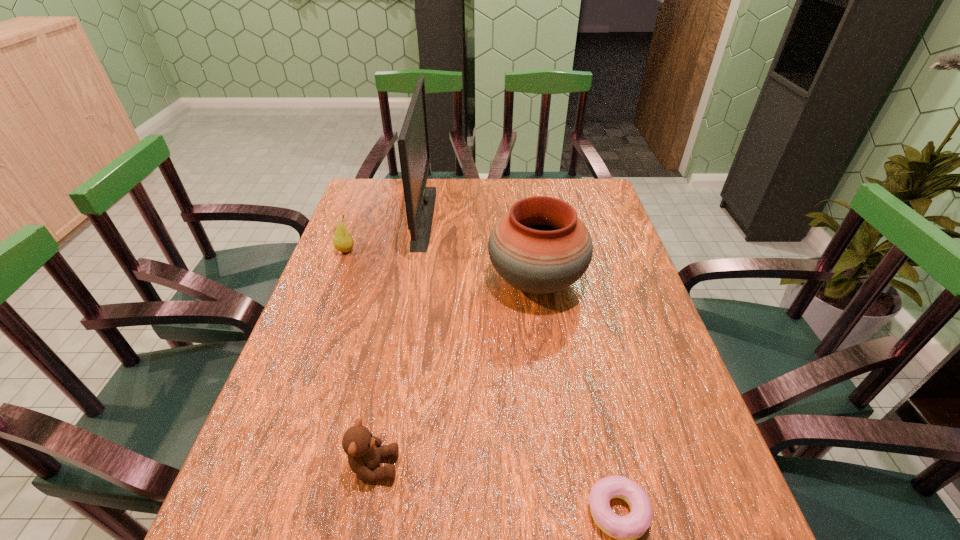
Locate an element on the screen. This screenshot has height=540, width=960. object situated at the right edge is located at coordinates (540, 246).

In the image, there is a desktop. Where is `free space at the far edge`? free space at the far edge is located at coordinates (441, 180).

Locate an element on the screen. vacant space at the left edge is located at coordinates (348, 287).

At what (x,y) coordinates should I click in order to perform the action: click on free space at the right edge of the desktop. Please return your answer as a coordinate pair (x, y). Looking at the image, I should click on (597, 241).

I want to click on free space at the far right corner, so click(588, 195).

The width and height of the screenshot is (960, 540). I want to click on free space between the teddy bear and the pear, so click(360, 359).

What are the coordinates of `free point between the tallest object and the pear` in the screenshot? It's located at (385, 234).

You are a GUI agent. You are given a task and a screenshot of the screen. Output one action in this format:
    pyautogui.click(x=<x>, y=<y>)
    Task: Click on the free spot between the teddy bear and the leftmost object
    The width and height of the screenshot is (960, 540).
    Given the screenshot: What is the action you would take?
    pyautogui.click(x=360, y=359)

You are a GUI agent. You are given a task and a screenshot of the screen. Output one action in this format:
    pyautogui.click(x=<x>, y=<y>)
    Task: Click on the vacant area that lies between the monitor and the second tallest object
    This screenshot has width=960, height=540.
    Given the screenshot: What is the action you would take?
    pyautogui.click(x=480, y=249)

The image size is (960, 540). In order to click on empty location between the teddy bear and the pottery in this screenshot , I will do point(455,374).